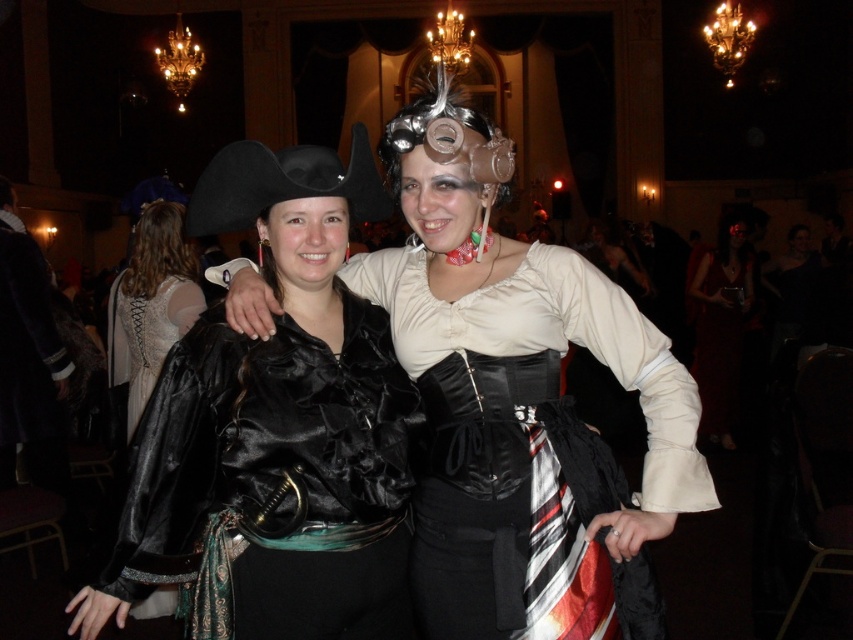
Question: Can you confirm if satin black vest at center is bigger than velvet red dress at center?

Choices:
 (A) no
 (B) yes

Answer: (A)

Question: Does satin black vest at center have a larger size compared to matte black dress at center?

Choices:
 (A) no
 (B) yes

Answer: (A)

Question: Which is nearer to the matte black dress at center?

Choices:
 (A) satin black vest at center
 (B) velvet red dress at center

Answer: (A)

Question: Which object appears closest to the camera in this image?

Choices:
 (A) velvet red dress at center
 (B) matte black dress at center
 (C) satin black vest at center
 (D) shiny black pirate costume at center

Answer: (D)

Question: Which point appears farthest from the camera in this image?

Choices:
 (A) (210, 516)
 (B) (703, 419)

Answer: (B)

Question: Considering the relative positions of satin black vest at center and matte black dress at center in the image provided, where is satin black vest at center located with respect to matte black dress at center?

Choices:
 (A) left
 (B) right

Answer: (B)